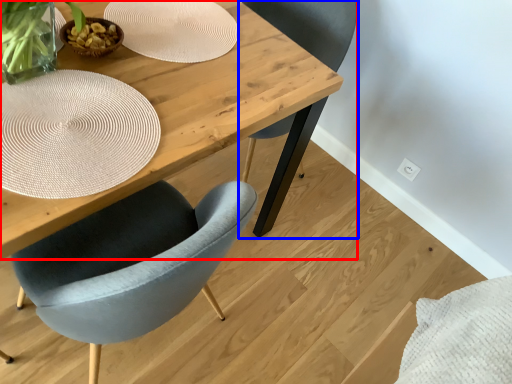
Question: Which object appears closest to the camera in this image, table (highlighted by a red box) or chair (highlighted by a blue box)?

Choices:
 (A) table
 (B) chair

Answer: (A)